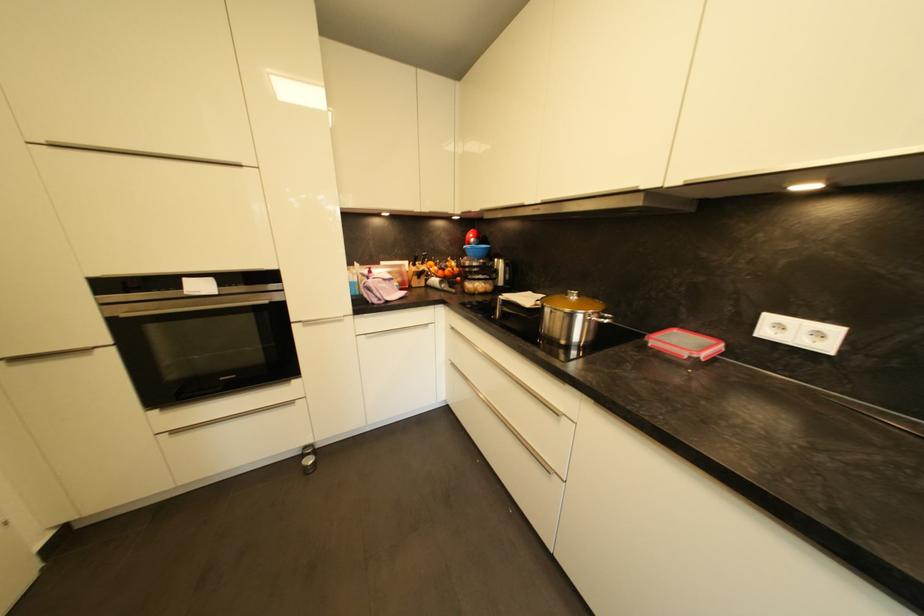
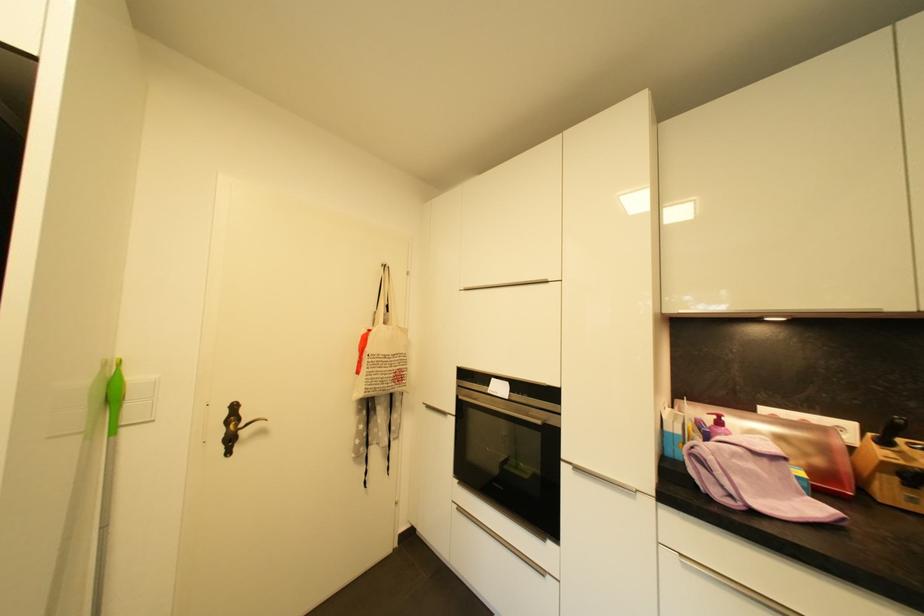
Find the pixel in the second image that matches (x=305, y=325) in the first image.

(576, 469)